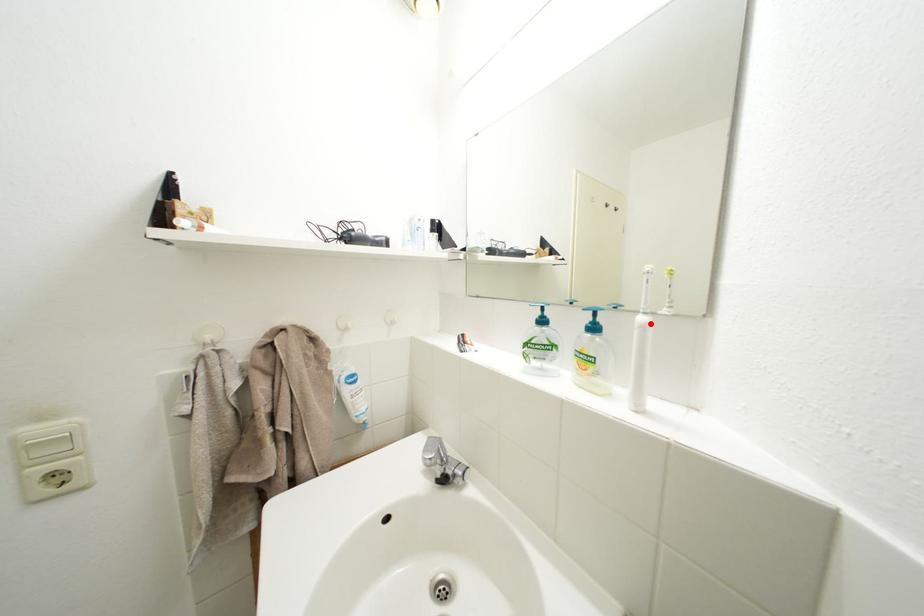
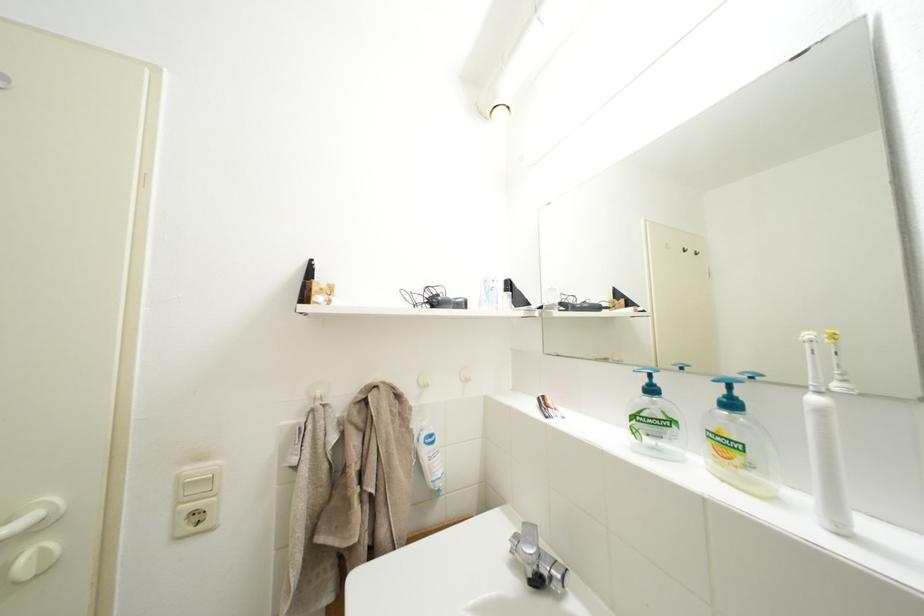
Where in the second image is the point corresponding to the highlighted location from the first image?

(823, 405)